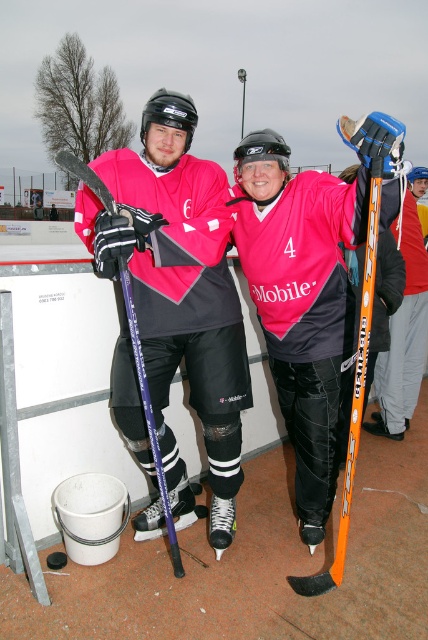
You are standing at the point marked as point (x=413, y=285) on the ice rink. You want to take a photo of the two hockey players using a camera that has a maximum range of 12 feet. Will you be able to capture them clearly in your photo?

The distance between point (x=413, y=285) and the camera is 13.01 feet, which exceeds the camera maximum range of 12 feet. Therefore, you won not be able to capture them clearly in your photo.

You are a hockey coach observing two players on the ice rink. You notice the orange metallic hockey stick at center and the purple glossy hockey stick at left. Which hockey stick is located to the right of the other?

The orange metallic hockey stick at center is positioned on the right side of purple glossy hockey stick at left.

You are a photographer at the ice rink and want to capture a photo where both the pink matte hockey jersey at center and the orange metallic hockey stick at center are clearly visible. Since you want to focus on the jersey, which object should you adjust your camera to prioritize in terms of size in the frame?

The pink matte hockey jersey at center is wider than the orange metallic hockey stick at center. Therefore, to prioritize the jersey in terms of size, you should adjust your camera to focus on the pink matte hockey jersey at center as it naturally occupies more space in the frame.